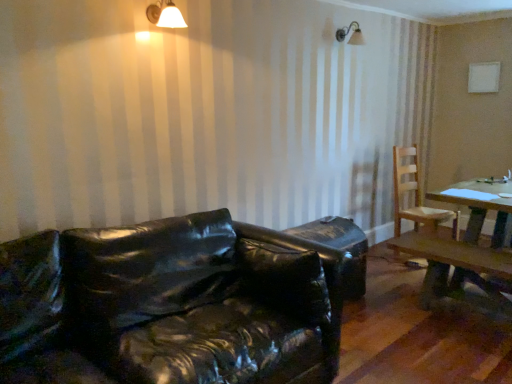
Question: Considering the relative positions of white matte light fixture at upper center and light brown wooden chair at right in the image provided, is white matte light fixture at upper center in front of light brown wooden chair at right?

Choices:
 (A) no
 (B) yes

Answer: (B)

Question: Is white matte light fixture at upper center thinner than light brown wooden chair at right?

Choices:
 (A) yes
 (B) no

Answer: (A)

Question: Is the depth of white matte light fixture at upper center greater than that of light brown wooden chair at right?

Choices:
 (A) yes
 (B) no

Answer: (B)

Question: From a real-world perspective, is white matte light fixture at upper center below light brown wooden chair at right?

Choices:
 (A) yes
 (B) no

Answer: (B)

Question: Is white matte light fixture at upper center smaller than light brown wooden chair at right?

Choices:
 (A) yes
 (B) no

Answer: (A)

Question: Is light brown wooden chair at right taller or shorter than glossy black leather couch at lower left?

Choices:
 (A) tall
 (B) short

Answer: (A)

Question: From a real-world perspective, is light brown wooden chair at right physically located above or below glossy black leather couch at lower left?

Choices:
 (A) below
 (B) above

Answer: (B)

Question: Considering the positions of light brown wooden chair at right and glossy black leather couch at lower left in the image, is light brown wooden chair at right wider or thinner than glossy black leather couch at lower left?

Choices:
 (A) thin
 (B) wide

Answer: (A)

Question: Considering the relative positions of light brown wooden chair at right and glossy black leather couch at lower left in the image provided, is light brown wooden chair at right to the left or to the right of glossy black leather couch at lower left?

Choices:
 (A) left
 (B) right

Answer: (B)

Question: Considering the positions of white matte light fixture at upper center and glossy black leather couch at lower left in the image, is white matte light fixture at upper center bigger or smaller than glossy black leather couch at lower left?

Choices:
 (A) big
 (B) small

Answer: (B)

Question: From a real-world perspective, is white matte light fixture at upper center physically located above or below glossy black leather couch at lower left?

Choices:
 (A) below
 (B) above

Answer: (B)

Question: Is white matte light fixture at upper center situated inside glossy black leather couch at lower left or outside?

Choices:
 (A) inside
 (B) outside

Answer: (B)

Question: In the image, is white matte light fixture at upper center positioned in front of or behind glossy black leather couch at lower left?

Choices:
 (A) front
 (B) behind

Answer: (B)

Question: Is glossy black leather couch at lower left bigger or smaller than light brown wooden chair at right?

Choices:
 (A) big
 (B) small

Answer: (A)

Question: Is point (263, 316) closer or farther from the camera than point (416, 203)?

Choices:
 (A) farther
 (B) closer

Answer: (B)